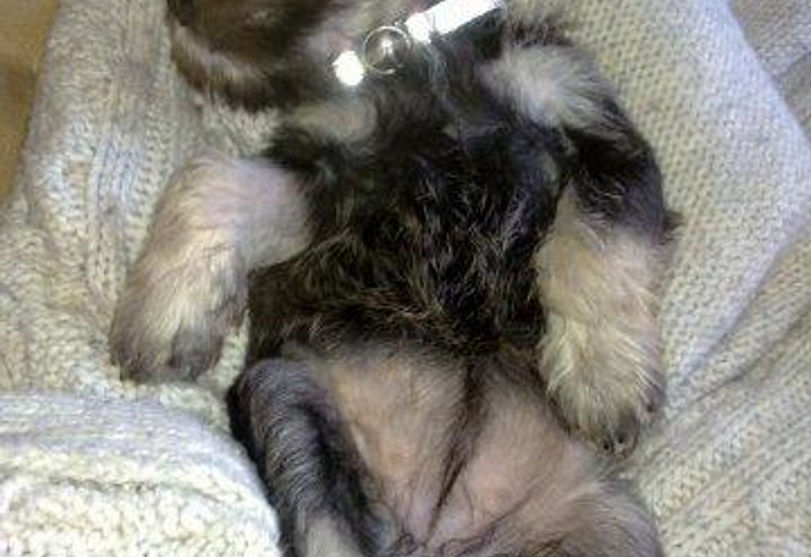
Identify the location of white fur. (542, 91).